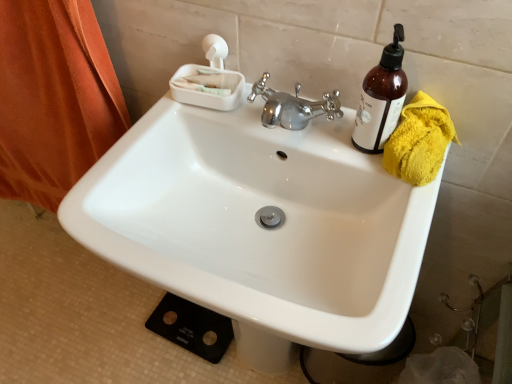
Identify the location of yellow fluffy towel at right. (419, 141).

Would you say white glossy sink at center is a long distance from yellow fluffy towel at right?

No, white glossy sink at center is in close proximity to yellow fluffy towel at right.

Identify the location of bath towel behind the white glossy sink at center. (419, 141).

Which is farther from the camera, (410, 192) or (433, 126)?

Point (433, 126)

In terms of width, does white glossy sink at center look wider or thinner when compared to yellow fluffy towel at right?

Considering their sizes, white glossy sink at center looks broader than yellow fluffy towel at right.

Considering the relative sizes of white plastic soap dish at upper center and translucent amber bottle at upper right in the image provided, is white plastic soap dish at upper center wider than translucent amber bottle at upper right?

Correct, the width of white plastic soap dish at upper center exceeds that of translucent amber bottle at upper right.

Is white plastic soap dish at upper center inside or outside of translucent amber bottle at upper right?

white plastic soap dish at upper center is located beyond the bounds of translucent amber bottle at upper right.

In the scene shown: Is white plastic soap dish at upper center smaller than translucent amber bottle at upper right?

No.

Which is in front, point (229, 71) or point (380, 120)?

The point (380, 120) is in front.

Is white glossy sink at center inside orange fabric at left?

That's incorrect, white glossy sink at center is not inside orange fabric at left.

In terms of height, does orange fabric at left look taller or shorter compared to white glossy sink at center?

Considering their sizes, orange fabric at left has more height than white glossy sink at center.

Consider the image. From a real-world perspective, is orange fabric at left physically located above or below white glossy sink at center?

In terms of real-world spatial position, orange fabric at left is above white glossy sink at center.

Is white glossy sink at center completely or partially outside of translucent amber bottle at upper right?

Indeed, white glossy sink at center is completely outside translucent amber bottle at upper right.

Consider the image. From the image's perspective, is white glossy sink at center located above or below translucent amber bottle at upper right?

From the image's perspective, white glossy sink at center appears below translucent amber bottle at upper right.

Which is less distant, (255, 215) or (393, 64)?

Clearly, point (255, 215) is more distant from the camera than point (393, 64).

How much distance is there between translucent amber bottle at upper right and white glossy sink at center?

translucent amber bottle at upper right and white glossy sink at center are 24.81 centimeters apart.

Which of these two, translucent amber bottle at upper right or white glossy sink at center, is smaller?

Smaller between the two is translucent amber bottle at upper right.

Can white glossy sink at center be found inside translucent amber bottle at upper right?

That's incorrect, white glossy sink at center is not inside translucent amber bottle at upper right.

Between translucent amber bottle at upper right and white glossy sink at center, which one appears on the left side from the viewer's perspective?

Positioned to the left is white glossy sink at center.

In the scene shown: Do you think yellow fluffy towel at right is within orange fabric at left, or outside of it?

yellow fluffy towel at right exists outside the volume of orange fabric at left.

From a real-world perspective, between yellow fluffy towel at right and orange fabric at left, who is vertically lower?

orange fabric at left.

Locate an element on the screen. Image resolution: width=512 pixels, height=384 pixels. bath towel that is on the right side of orange fabric at left is located at coordinates (419, 141).

Would you consider yellow fluffy towel at right to be distant from orange fabric at left?

yellow fluffy towel at right is actually quite close to orange fabric at left.

Is white plastic soap dish at upper center positioned with its back to yellow fluffy towel at right?

No, white plastic soap dish at upper center is not facing the opposite direction of yellow fluffy towel at right.

From the image's perspective, is white plastic soap dish at upper center below yellow fluffy towel at right?

No, from the image's perspective, white plastic soap dish at upper center is not beneath yellow fluffy towel at right.

Is white plastic soap dish at upper center not close to yellow fluffy towel at right?

No.

Is white plastic soap dish at upper center wider than yellow fluffy towel at right?

No.

Image resolution: width=512 pixels, height=384 pixels. Find the location of `bath towel above the white glossy sink at center (from the image's perspective)`. bath towel above the white glossy sink at center (from the image's perspective) is located at coordinates (419, 141).

Locate an element on the screen. tissue directly beneath the translucent amber bottle at upper right (from a real-world perspective) is located at coordinates (209, 80).

When comparing their distances from white plastic soap dish at upper center, does white glossy sink at center or yellow fluffy towel at right seem further?

The object further to white plastic soap dish at upper center is yellow fluffy towel at right.

Estimate the real-world distances between objects in this image. Which object is closer to white glossy sink at center, white plastic soap dish at upper center or translucent amber bottle at upper right?

white plastic soap dish at upper center is positioned closer to the anchor white glossy sink at center.

When comparing their distances from yellow fluffy towel at right, does white glossy sink at center or translucent amber bottle at upper right seem closer?

Among the two, translucent amber bottle at upper right is located nearer to yellow fluffy towel at right.

Based on their spatial positions, is white glossy sink at center or white plastic soap dish at upper center further from translucent amber bottle at upper right?

white plastic soap dish at upper center lies further to translucent amber bottle at upper right than the other object.

Based on their spatial positions, is white plastic soap dish at upper center or white glossy sink at center further from yellow fluffy towel at right?

white plastic soap dish at upper center.

Based on their spatial positions, is orange fabric at left or translucent amber bottle at upper right closer to white plastic soap dish at upper center?

translucent amber bottle at upper right is positioned closer to the anchor white plastic soap dish at upper center.

Which object lies nearer to the anchor point white plastic soap dish at upper center, translucent amber bottle at upper right or yellow fluffy towel at right?

Based on the image, translucent amber bottle at upper right appears to be nearer to white plastic soap dish at upper center.

When comparing their distances from white plastic soap dish at upper center, does translucent amber bottle at upper right or white glossy sink at center seem closer?

Among the two, white glossy sink at center is located nearer to white plastic soap dish at upper center.

The height and width of the screenshot is (384, 512). I want to click on tissue between orange fabric at left and white glossy sink at center in the horizontal direction, so click(209, 80).

Locate an element on the screen. bath towel between white plastic soap dish at upper center and white glossy sink at center in the up-down direction is located at coordinates (419, 141).

The image size is (512, 384). Identify the location of sink situated between orange fabric at left and yellow fluffy towel at right from left to right. (259, 226).

Locate an element on the screen. The width and height of the screenshot is (512, 384). bottle between white plastic soap dish at upper center and yellow fluffy towel at right is located at coordinates (381, 98).